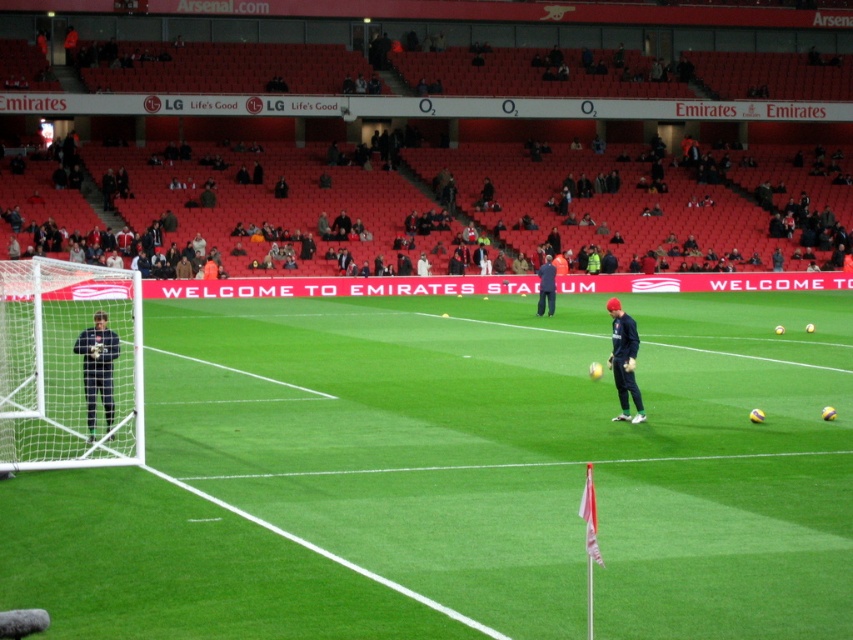
You are a photographer positioned at the edge of the field. You want to capture both the dark blue tracksuit at center and the dark blue uniform at center in a single photo. Which subject should you focus on to ensure both are in frame without zooming in or out?

The dark blue tracksuit at center is wider than the dark blue uniform at center, so focusing on the dark blue tracksuit at center will ensure both are in frame without needing to adjust the zoom.

You are a drone operator trying to capture a closeup shot of the dark blue tracksuit at center. The stadium has a coordinate system where the bottom left corner is point 0,0 and the top right corner is 1,1. What coordinate should you aim for to get the best shot?

The dark blue tracksuit at center is located at point (492, 198), so you should aim for that coordinate to capture the best closeup shot.

You are a photographer positioned at the edge of the field. You want to take a photo that includes both the dark blue tracksuit at center and the dark blue uniform at center. Which one should you adjust your camera angle to focus on first to ensure both are in frame?

The dark blue uniform at center is behind the dark blue tracksuit at center, so you should focus on the dark blue tracksuit at center first to ensure both are in frame.